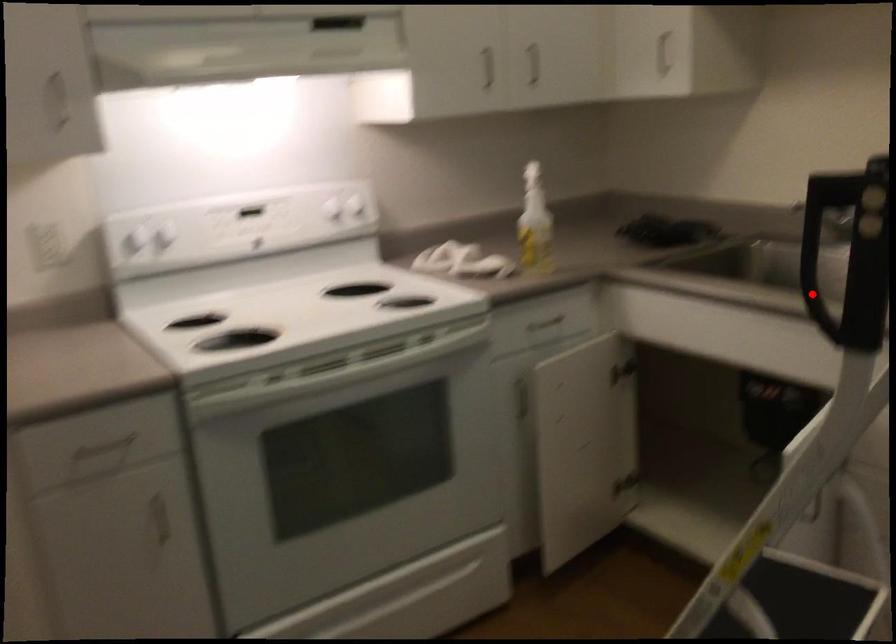
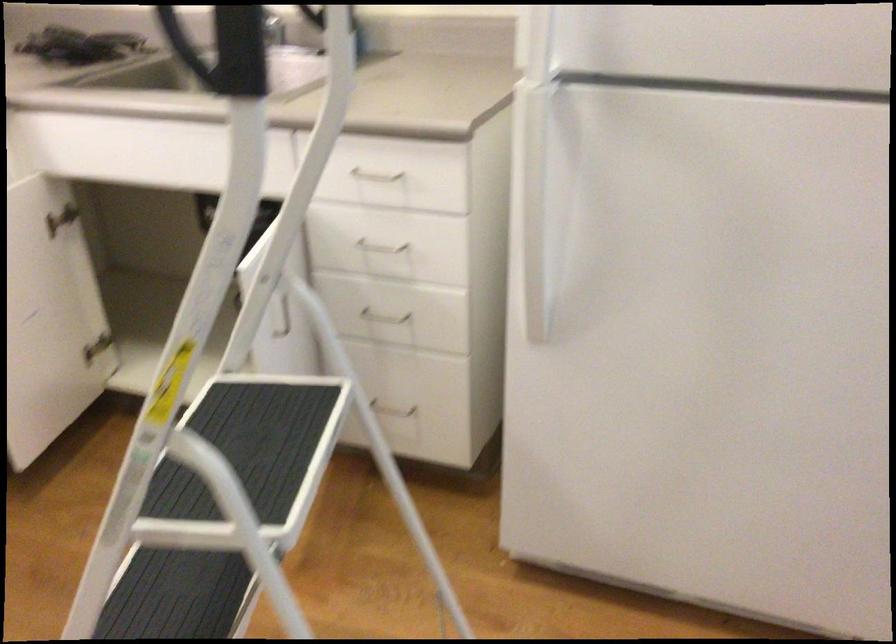
Question: I am providing you with two images of the same scene from different viewpoints. In image1, a red point is highlighted. Considering the same 3D point in image2, which of the following is correct?

Choices:
 (A) It is closer
 (B) It is farther

Answer: (A)